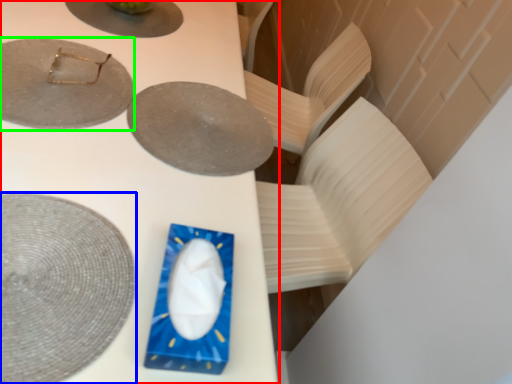
Question: Which is farther away from table (highlighted by a red box)? plate (highlighted by a blue box) or plate (highlighted by a green box)?

Choices:
 (A) plate
 (B) plate

Answer: (A)